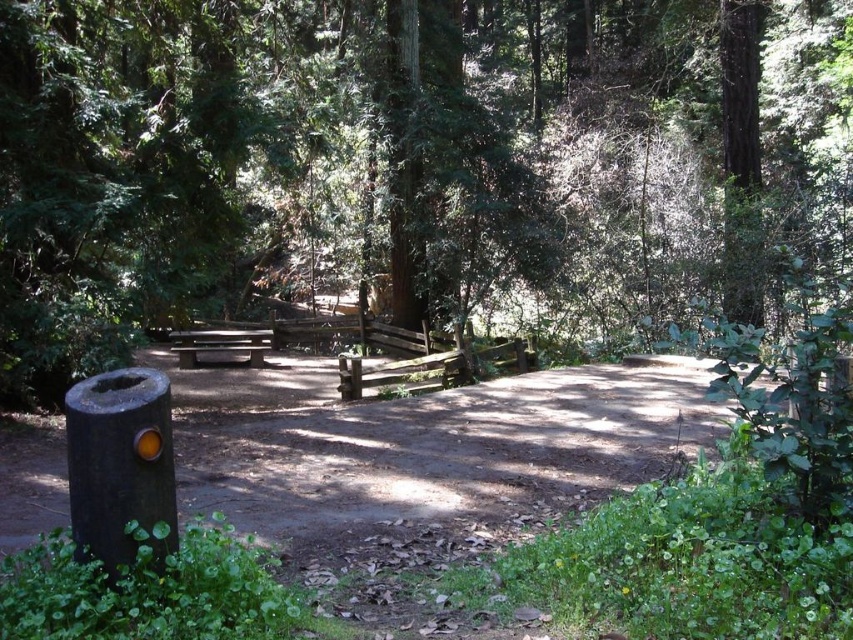
Question: Which is nearer to the brown wood tree at center?

Choices:
 (A) black matte post at lower left
 (B) smooth brown picnic table at center

Answer: (A)

Question: Does black matte post at lower left have a greater width compared to smooth brown picnic table at center?

Choices:
 (A) yes
 (B) no

Answer: (A)

Question: Estimate the real-world distances between objects in this image. Which object is closer to the black matte post at lower left?

Choices:
 (A) smooth brown picnic table at center
 (B) brown wood tree at center

Answer: (A)

Question: Estimate the real-world distances between objects in this image. Which object is closer to the black matte post at lower left?

Choices:
 (A) brown wood tree at center
 (B) smooth brown picnic table at center

Answer: (B)

Question: Is brown wood tree at center closer to the viewer compared to black matte post at lower left?

Choices:
 (A) no
 (B) yes

Answer: (A)

Question: Does black matte post at lower left appear on the left side of smooth brown picnic table at center?

Choices:
 (A) no
 (B) yes

Answer: (A)